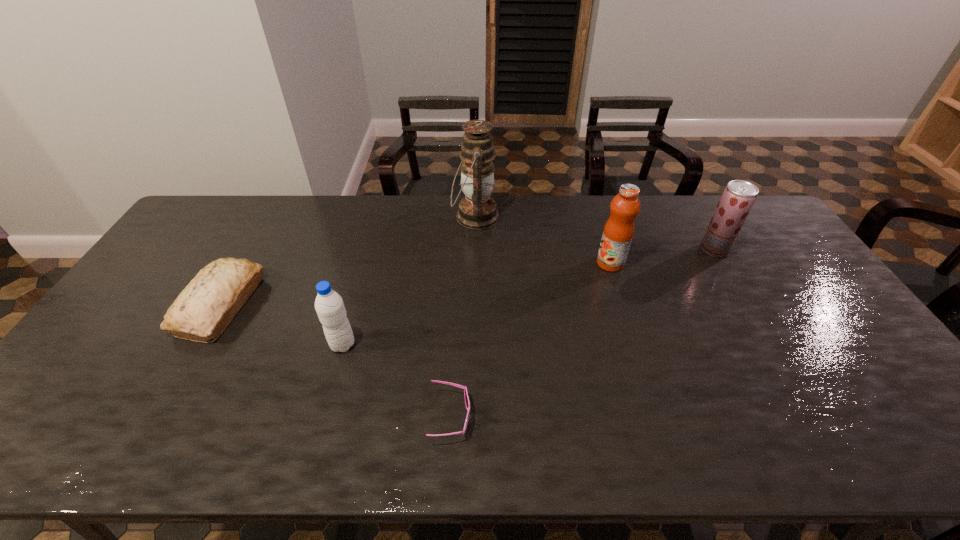
This screenshot has width=960, height=540. Find the location of `free spot located on the front of the lantern`. free spot located on the front of the lantern is located at coordinates (474, 307).

Image resolution: width=960 pixels, height=540 pixels. In order to click on vacant region located on the front label of the left fruit juice in this screenshot , I will do `click(471, 263)`.

I want to click on vacant position located on the front label of the left fruit juice, so click(553, 263).

Image resolution: width=960 pixels, height=540 pixels. I want to click on blank area located on the front label of the left fruit juice, so click(491, 263).

Locate an element on the screen. The width and height of the screenshot is (960, 540). vacant position located on the front of the right fruit juice is located at coordinates (739, 292).

Where is `vacant space located 0.060m on the back of the water bottle`? This screenshot has width=960, height=540. vacant space located 0.060m on the back of the water bottle is located at coordinates (350, 318).

This screenshot has height=540, width=960. Find the location of `vacant area situated on the front of the leftmost object`. vacant area situated on the front of the leftmost object is located at coordinates (187, 364).

The image size is (960, 540). Find the location of `free region located on the front-facing side of the shortest object`. free region located on the front-facing side of the shortest object is located at coordinates (612, 417).

Locate an element on the screen. object present at the far edge is located at coordinates (477, 210).

The image size is (960, 540). Find the location of `object situated at the near edge`. object situated at the near edge is located at coordinates (467, 402).